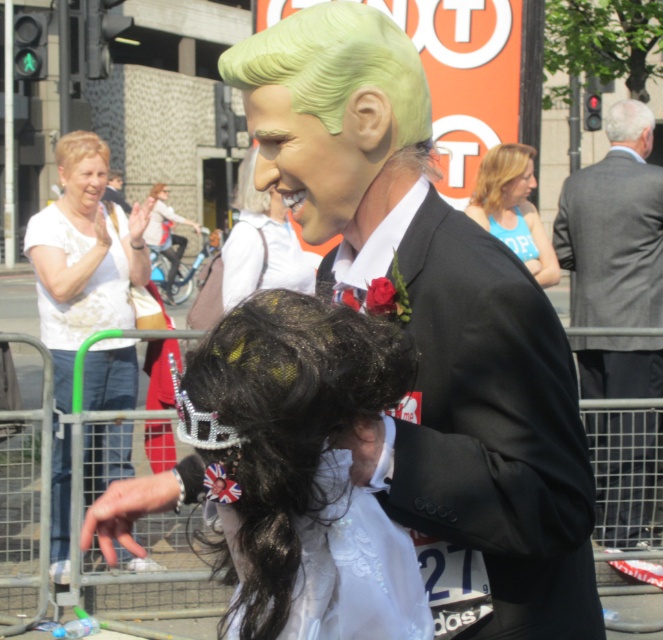
Question: Considering the real-world distances, which object is closest to the blonde synthetic wig at upper center?

Choices:
 (A) light green plastic wig at upper center
 (B) blue fabric tank top at upper right
 (C) green matte wig at center

Answer: (B)

Question: Which object is the closest to the blonde synthetic wig at upper left?

Choices:
 (A) matte white wig at upper center
 (B) white satin dress at center
 (C) smooth blonde wig at center

Answer: (C)

Question: Is blonde synthetic wig at upper center bigger than metallic silver bicycle at center?

Choices:
 (A) no
 (B) yes

Answer: (A)

Question: Based on their relative distances, which object is nearer to the white matte hair at upper right?

Choices:
 (A) blonde synthetic wig at upper left
 (B) light green synthetic wig at upper center
 (C) light skin tone face at upper left
 (D) white lace shirt at left

Answer: (C)

Question: From the image, what is the correct spatial relationship of white lace shirt at left in relation to white satin dress at center?

Choices:
 (A) right
 (B) left

Answer: (B)

Question: Observing the image, what is the correct spatial positioning of gray suit at center in reference to light green plastic wig at upper center?

Choices:
 (A) left
 (B) right

Answer: (B)